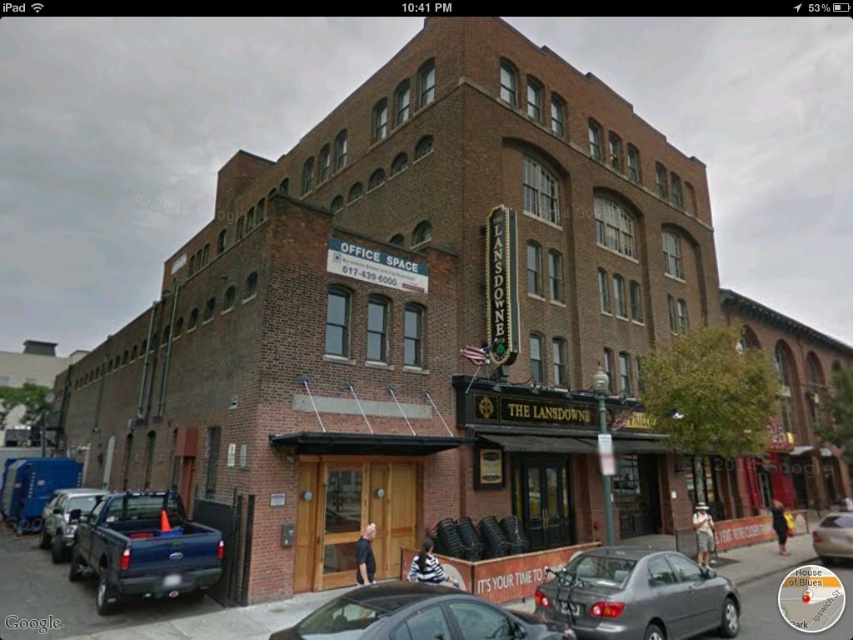
Question: Among these points, which one is nearest to the camera?

Choices:
 (A) (596, 588)
 (B) (824, 561)
 (C) (48, 506)
 (D) (219, 568)

Answer: (A)

Question: Is matte gray sedan at lower center thinner than shiny black sedan at center?

Choices:
 (A) no
 (B) yes

Answer: (A)

Question: Based on their relative distances, which object is nearer to the silver metallic sedan at center?

Choices:
 (A) blue matte truck at lower left
 (B) matte gray sedan at lower center

Answer: (B)

Question: In this image, where is shiny black sedan at center located relative to matte black truck at left?

Choices:
 (A) above
 (B) below

Answer: (A)

Question: Is blue matte truck at lower left below silver metallic sedan at center?

Choices:
 (A) no
 (B) yes

Answer: (A)

Question: Which object is closer to the camera taking this photo?

Choices:
 (A) matte gray sedan at lower center
 (B) silver metallic sedan at center
 (C) blue matte truck at lower left

Answer: (A)